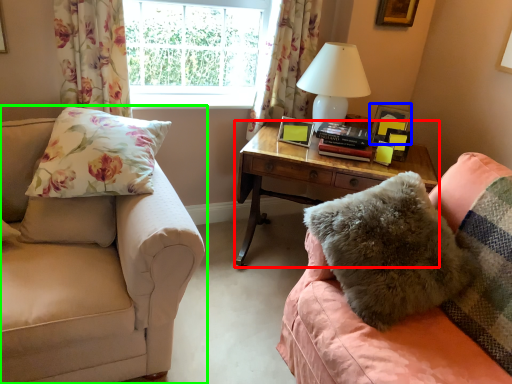
Question: Estimate the real-world distances between objects in this image. Which object is closer to nightstand (highlighted by a red box), picture frame (highlighted by a blue box) or studio couch (highlighted by a green box)?

Choices:
 (A) picture frame
 (B) studio couch

Answer: (A)